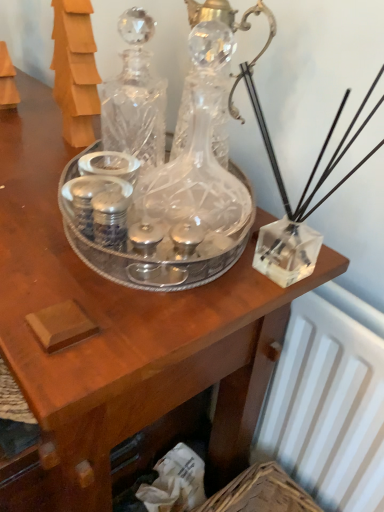
Consider the image. Measure the distance between clear crystal decanter at center, which appears as the 2th glass bottle when viewed from the front, and camera.

clear crystal decanter at center, which appears as the 2th glass bottle when viewed from the front, is 62.95 centimeters away from camera.

Where is `clear crystal decanter at center, which appears as the 2th glass bottle when viewed from the front`? Image resolution: width=384 pixels, height=512 pixels. clear crystal decanter at center, which appears as the 2th glass bottle when viewed from the front is located at coordinates (135, 97).

What is the approximate width of clear crystal decanter at center, which appears as the 2th glass bottle when viewed from the front?

clear crystal decanter at center, which appears as the 2th glass bottle when viewed from the front, is 3.06 inches in width.

The width and height of the screenshot is (384, 512). What do you see at coordinates (135, 97) in the screenshot?
I see `clear crystal decanter at center, positioned as the first glass bottle in back-to-front order` at bounding box center [135, 97].

What do you see at coordinates (194, 183) in the screenshot? This screenshot has height=512, width=384. I see `transparent crystal decanter at center, which appears as the second glass bottle when viewed from the back` at bounding box center [194, 183].

In order to face transparent crystal decanter at center, which appears as the second glass bottle when viewed from the back, should I rotate leftwards or rightwards?

Turn right approximately 1.060 degrees to face it.

In order to click on transparent crystal decanter at center, which ranks as the 1th glass bottle in front-to-back order in this screenshot , I will do `click(194, 183)`.

The width and height of the screenshot is (384, 512). In order to click on clear crystal decanter at center, which appears as the 2th glass bottle when viewed from the front in this screenshot , I will do `click(135, 97)`.

Is transparent crystal decanter at center, which ranks as the 1th glass bottle in front-to-back order, to the left of clear crystal decanter at center, positioned as the first glass bottle in back-to-front order, from the viewer's perspective?

No, transparent crystal decanter at center, which ranks as the 1th glass bottle in front-to-back order, is not to the left of clear crystal decanter at center, positioned as the first glass bottle in back-to-front order.

Which is in front, transparent crystal decanter at center, which ranks as the 1th glass bottle in front-to-back order, or clear crystal decanter at center, which appears as the 2th glass bottle when viewed from the front?

transparent crystal decanter at center, which ranks as the 1th glass bottle in front-to-back order, is in front.

Does point (166, 207) appear closer or farther from the camera than point (135, 116)?

Point (166, 207).

From the picture: From the image's perspective, relative to clear crystal decanter at center, which appears as the 2th glass bottle when viewed from the front, is transparent crystal decanter at center, which appears as the second glass bottle when viewed from the back, above or below?

Based on their image positions, transparent crystal decanter at center, which appears as the second glass bottle when viewed from the back, is located beneath clear crystal decanter at center, which appears as the 2th glass bottle when viewed from the front.

From a real-world perspective, which is physically below, transparent crystal decanter at center, which appears as the second glass bottle when viewed from the back, or clear crystal decanter at center, which appears as the 2th glass bottle when viewed from the front?

transparent crystal decanter at center, which appears as the second glass bottle when viewed from the back.

Which of these two, transparent crystal decanter at center, which appears as the second glass bottle when viewed from the back, or clear crystal decanter at center, which appears as the 2th glass bottle when viewed from the front, is thinner?

With smaller width is clear crystal decanter at center, which appears as the 2th glass bottle when viewed from the front.

From their relative heights in the image, would you say transparent crystal decanter at center, which appears as the second glass bottle when viewed from the back, is taller or shorter than clear crystal decanter at center, positioned as the first glass bottle in back-to-front order?

Clearly, transparent crystal decanter at center, which appears as the second glass bottle when viewed from the back, is taller compared to clear crystal decanter at center, positioned as the first glass bottle in back-to-front order.

Consider the image. Does transparent crystal decanter at center, which ranks as the 1th glass bottle in front-to-back order, have a smaller size compared to clear crystal decanter at center, positioned as the first glass bottle in back-to-front order?

No.

Is transparent crystal decanter at center, which appears as the second glass bottle when viewed from the back, positioned beyond the bounds of clear crystal decanter at center, which appears as the 2th glass bottle when viewed from the front?

Yes.

Is transparent crystal decanter at center, which appears as the second glass bottle when viewed from the back, not near clear crystal decanter at center, which appears as the 2th glass bottle when viewed from the front?

No.

Consider the image. Is transparent crystal decanter at center, which appears as the second glass bottle when viewed from the back, facing towards clear crystal decanter at center, positioned as the first glass bottle in back-to-front order?

No, transparent crystal decanter at center, which appears as the second glass bottle when viewed from the back, is not turned towards clear crystal decanter at center, positioned as the first glass bottle in back-to-front order.

Measure the distance from transparent crystal decanter at center, which ranks as the 1th glass bottle in front-to-back order, to clear crystal decanter at center, which appears as the 2th glass bottle when viewed from the front.

transparent crystal decanter at center, which ranks as the 1th glass bottle in front-to-back order, is 14.04 centimeters from clear crystal decanter at center, which appears as the 2th glass bottle when viewed from the front.

You are a GUI agent. You are given a task and a screenshot of the screen. Output one action in this format:
    pyautogui.click(x=<x>, y=<y>)
    Task: Click on the glass bottle below the clear crystal decanter at center, positioned as the first glass bottle in back-to-front order (from the image's perspective)
    
    Given the screenshot: What is the action you would take?
    pyautogui.click(x=194, y=183)

Does clear crystal decanter at center, positioned as the first glass bottle in back-to-front order, appear on the left side of transparent crystal decanter at center, which ranks as the 1th glass bottle in front-to-back order?

Correct, you'll find clear crystal decanter at center, positioned as the first glass bottle in back-to-front order, to the left of transparent crystal decanter at center, which ranks as the 1th glass bottle in front-to-back order.

Is clear crystal decanter at center, which appears as the 2th glass bottle when viewed from the front, further to the viewer compared to transparent crystal decanter at center, which ranks as the 1th glass bottle in front-to-back order?

Yes, the depth of clear crystal decanter at center, which appears as the 2th glass bottle when viewed from the front, is greater than that of transparent crystal decanter at center, which ranks as the 1th glass bottle in front-to-back order.

Does point (153, 158) come in front of point (175, 207)?

No, (153, 158) is behind (175, 207).

From the image's perspective, is clear crystal decanter at center, positioned as the first glass bottle in back-to-front order, above or below transparent crystal decanter at center, which ranks as the 1th glass bottle in front-to-back order?

Based on their image positions, clear crystal decanter at center, positioned as the first glass bottle in back-to-front order, is located above transparent crystal decanter at center, which ranks as the 1th glass bottle in front-to-back order.

From a real-world perspective, who is located higher, clear crystal decanter at center, which appears as the 2th glass bottle when viewed from the front, or transparent crystal decanter at center, which ranks as the 1th glass bottle in front-to-back order?

In real-world perspective, clear crystal decanter at center, which appears as the 2th glass bottle when viewed from the front, is above.

Considering the sizes of clear crystal decanter at center, positioned as the first glass bottle in back-to-front order, and transparent crystal decanter at center, which appears as the second glass bottle when viewed from the back, in the image, is clear crystal decanter at center, positioned as the first glass bottle in back-to-front order, wider or thinner than transparent crystal decanter at center, which appears as the second glass bottle when viewed from the back,?

clear crystal decanter at center, positioned as the first glass bottle in back-to-front order, is thinner than transparent crystal decanter at center, which appears as the second glass bottle when viewed from the back.

From their relative heights in the image, would you say clear crystal decanter at center, which appears as the 2th glass bottle when viewed from the front, is taller or shorter than transparent crystal decanter at center, which appears as the second glass bottle when viewed from the back?

clear crystal decanter at center, which appears as the 2th glass bottle when viewed from the front, is shorter than transparent crystal decanter at center, which appears as the second glass bottle when viewed from the back.

Is clear crystal decanter at center, positioned as the first glass bottle in back-to-front order, smaller than transparent crystal decanter at center, which ranks as the 1th glass bottle in front-to-back order?

Yes, clear crystal decanter at center, positioned as the first glass bottle in back-to-front order, is smaller than transparent crystal decanter at center, which ranks as the 1th glass bottle in front-to-back order.

Would you say clear crystal decanter at center, positioned as the first glass bottle in back-to-front order, is inside or outside transparent crystal decanter at center, which appears as the second glass bottle when viewed from the back?

The correct answer is: outside.

Is there a large distance between clear crystal decanter at center, positioned as the first glass bottle in back-to-front order, and transparent crystal decanter at center, which appears as the second glass bottle when viewed from the back?

No, clear crystal decanter at center, positioned as the first glass bottle in back-to-front order, is not far from transparent crystal decanter at center, which appears as the second glass bottle when viewed from the back.

Does clear crystal decanter at center, positioned as the first glass bottle in back-to-front order, turn towards transparent crystal decanter at center, which appears as the second glass bottle when viewed from the back?

No, clear crystal decanter at center, positioned as the first glass bottle in back-to-front order, does not turn towards transparent crystal decanter at center, which appears as the second glass bottle when viewed from the back.

Based on the photo, measure the distance between clear crystal decanter at center, which appears as the 2th glass bottle when viewed from the front, and transparent crystal decanter at center, which appears as the second glass bottle when viewed from the back.

clear crystal decanter at center, which appears as the 2th glass bottle when viewed from the front, is 5.53 inches from transparent crystal decanter at center, which appears as the second glass bottle when viewed from the back.

The height and width of the screenshot is (512, 384). Find the location of `glass bottle that is on the right side of clear crystal decanter at center, which appears as the 2th glass bottle when viewed from the front`. glass bottle that is on the right side of clear crystal decanter at center, which appears as the 2th glass bottle when viewed from the front is located at coordinates tap(194, 183).

The height and width of the screenshot is (512, 384). In the image, there is a clear crystal decanter at center, which appears as the 2th glass bottle when viewed from the front. What are the coordinates of `glass bottle below it (from a real-world perspective)` in the screenshot? It's located at (194, 183).

Image resolution: width=384 pixels, height=512 pixels. I want to click on glass bottle on the right of clear crystal decanter at center, which appears as the 2th glass bottle when viewed from the front, so click(194, 183).